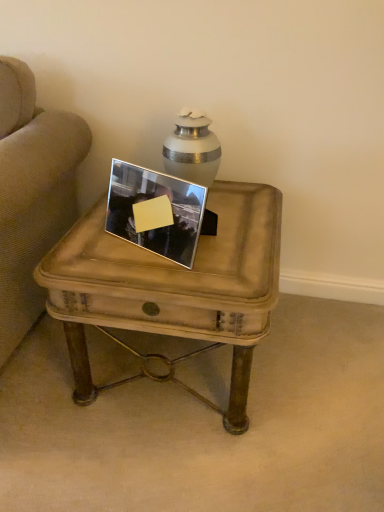
The image size is (384, 512). I want to click on free space above distressed wood coffee table at center (from a real-world perspective), so click(199, 238).